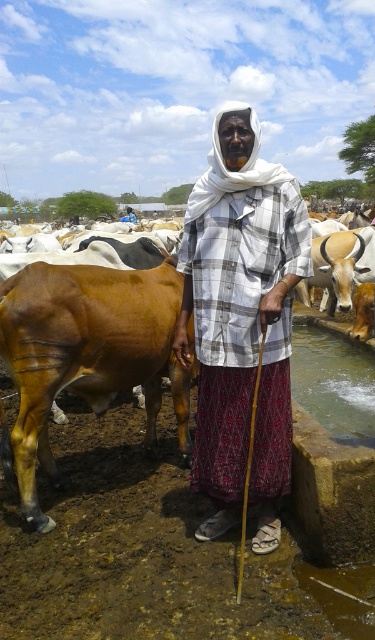
Is white checkered shirt at center bigger than brown glossy bull at left?

No, white checkered shirt at center is not bigger than brown glossy bull at left.

Is point (280, 451) closer to camera compared to point (82, 355)?

Yes, it is.

The width and height of the screenshot is (375, 640). Describe the element at coordinates (241, 321) in the screenshot. I see `white checkered shirt at center` at that location.

Locate an element on the screen. This screenshot has width=375, height=640. white checkered shirt at center is located at coordinates (241, 321).